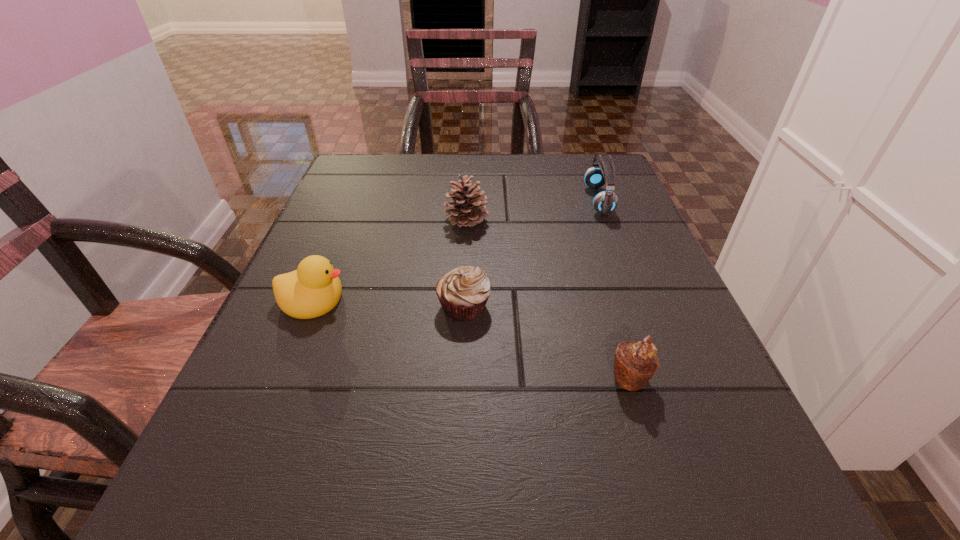
This screenshot has width=960, height=540. Find the location of `vacant space situated 0.200m on the back of the pinecone`. vacant space situated 0.200m on the back of the pinecone is located at coordinates (469, 166).

The width and height of the screenshot is (960, 540). I want to click on free space located 0.270m on the face of the leftmost object, so click(x=505, y=299).

Where is `free space located on the back of the taller muffin`? This screenshot has height=540, width=960. free space located on the back of the taller muffin is located at coordinates (589, 247).

Image resolution: width=960 pixels, height=540 pixels. I want to click on free space located 0.320m on the back of the shorter muffin, so click(468, 194).

Locate an element on the screen. The width and height of the screenshot is (960, 540). object present at the far edge is located at coordinates (605, 202).

Identify the location of object at the left edge. This screenshot has width=960, height=540. (314, 289).

Where is `headset that is at the right edge`? The image size is (960, 540). headset that is at the right edge is located at coordinates (605, 202).

Where is `muffin located at the right edge`? The width and height of the screenshot is (960, 540). muffin located at the right edge is located at coordinates (635, 363).

I want to click on object situated at the far right corner, so click(605, 202).

At what (x,y) coordinates should I click in order to perform the action: click on vacant space at the far edge. Please return your answer as a coordinate pair (x, y). Looking at the image, I should click on (503, 181).